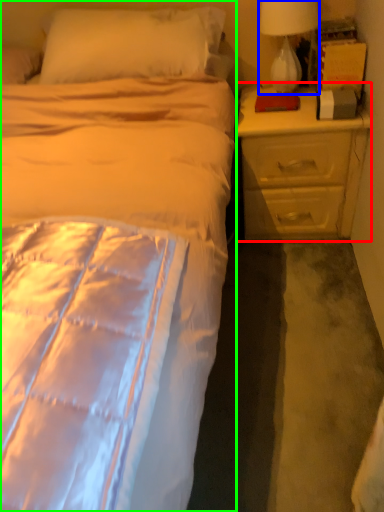
Question: Estimate the real-world distances between objects in this image. Which object is closer to nightstand (highlighted by a red box), lamp (highlighted by a blue box) or bed (highlighted by a green box)?

Choices:
 (A) lamp
 (B) bed

Answer: (A)